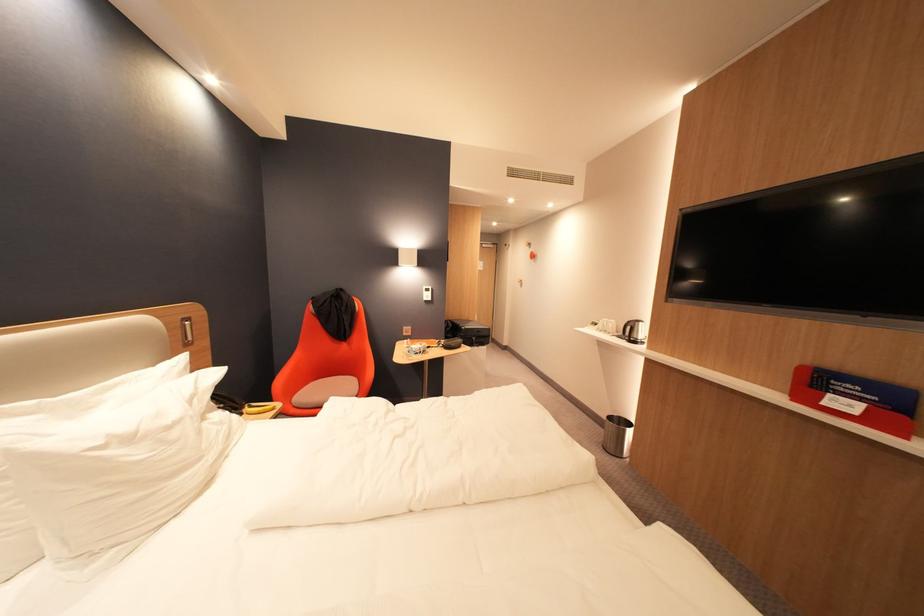
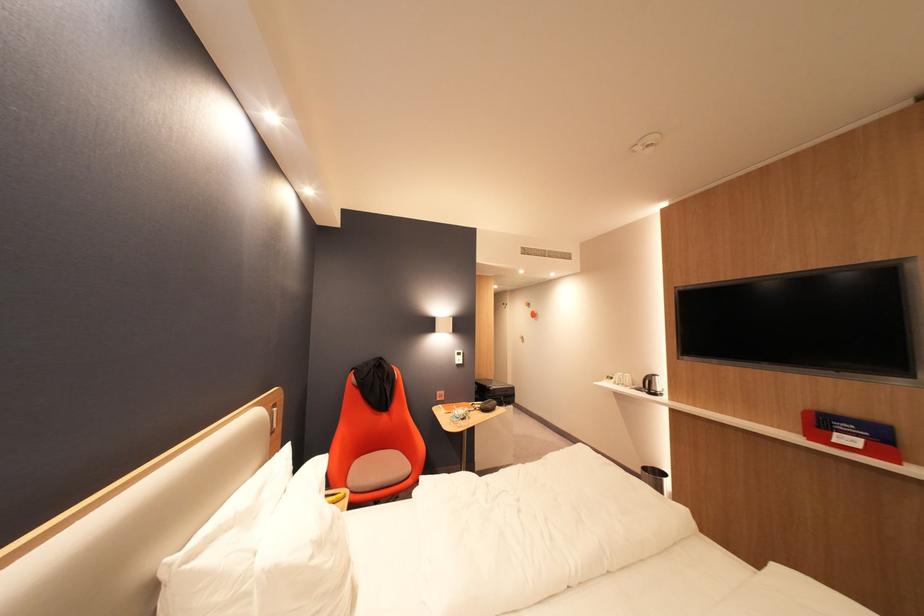
Question: Based on the continuous images, in which direction is the camera rotating? Reply with the corresponding letter.

Choices:
 (A) Left
 (B) Right
 (C) Up
 (D) Down

Answer: (C)